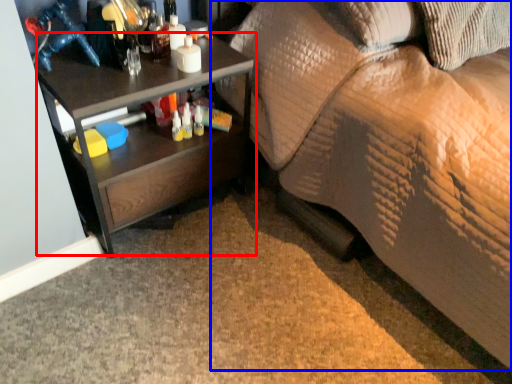
Question: Which object appears closest to the camera in this image, desk (highlighted by a red box) or studio couch (highlighted by a blue box)?

Choices:
 (A) desk
 (B) studio couch

Answer: (B)